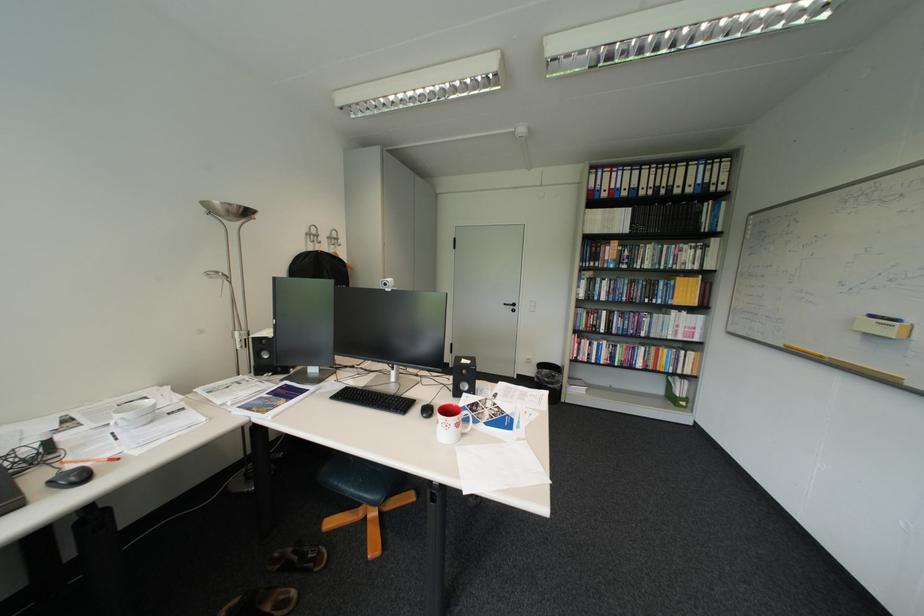
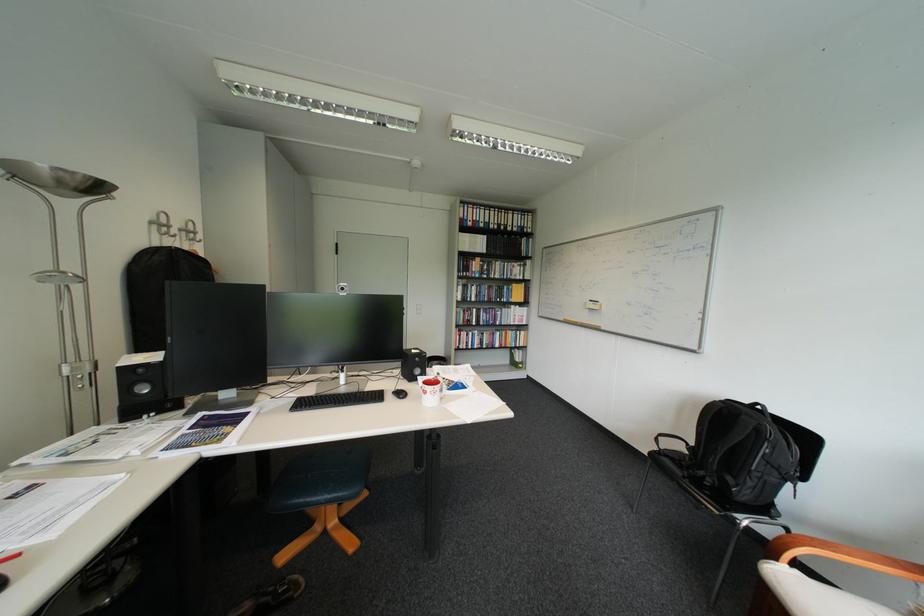
Find the pixel in the second image that matches (324,236) in the first image.

(173, 225)